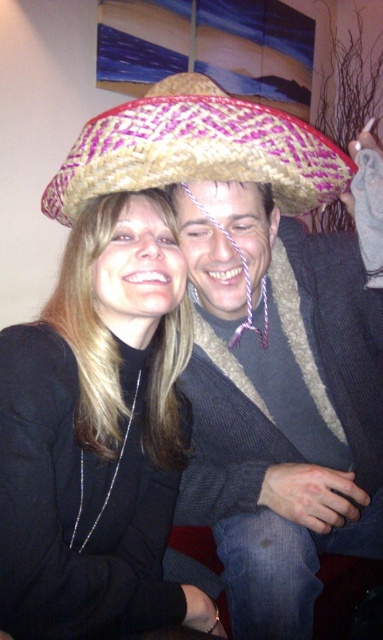
Does point (70, 236) lie behind point (142, 129)?

That is True.

Is matte straw sombrero at upper center wider than bright pink woven straw sombrero at center?

No, matte straw sombrero at upper center is not wider than bright pink woven straw sombrero at center.

Which is in front, point (36, 624) or point (155, 134)?

Positioned in front is point (36, 624).

Locate an element on the screen. This screenshot has height=640, width=383. matte straw sombrero at upper center is located at coordinates (98, 435).

Looking at this image, does woven straw sombrero at center appear on the left side of matte straw sombrero at upper center?

Incorrect, woven straw sombrero at center is not on the left side of matte straw sombrero at upper center.

Is point (281, 605) closer to viewer compared to point (196, 620)?

Yes, it is.

Where is `woven straw sombrero at center`? woven straw sombrero at center is located at coordinates (283, 394).

Identify the location of woven straw sombrero at center. (283, 394).

Which is below, woven straw sombrero at center or bright pink woven straw sombrero at center?

woven straw sombrero at center

Who is shorter, woven straw sombrero at center or bright pink woven straw sombrero at center?

bright pink woven straw sombrero at center is shorter.

Identify the location of woven straw sombrero at center. This screenshot has width=383, height=640. (283, 394).

This screenshot has height=640, width=383. I want to click on woven straw sombrero at center, so click(x=283, y=394).